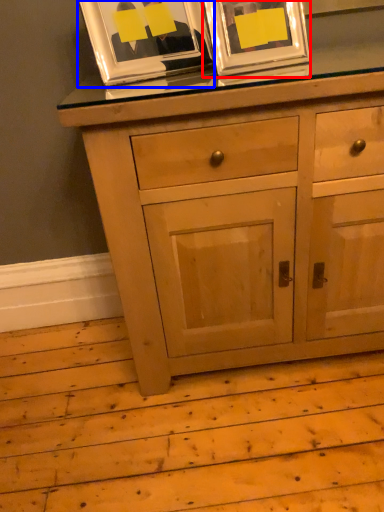
Question: Among these objects, which one is farthest to the camera, picture frame (highlighted by a red box) or picture frame (highlighted by a blue box)?

Choices:
 (A) picture frame
 (B) picture frame

Answer: (B)